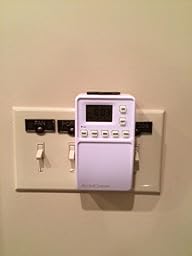
Where is `the leftmost light switch`? Image resolution: width=192 pixels, height=256 pixels. the leftmost light switch is located at coordinates (40, 154).